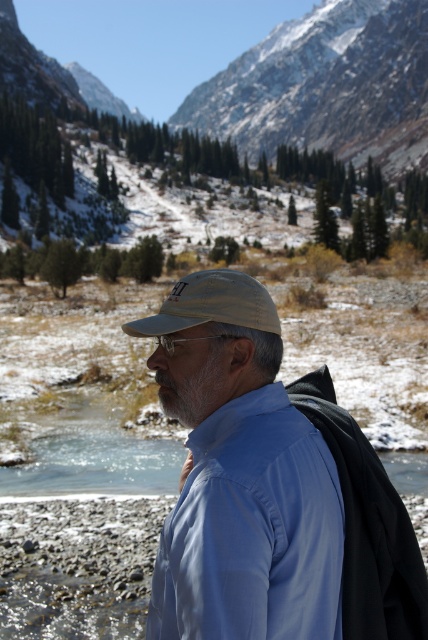
You are a photographer planning to capture a landscape shot with the blue smooth shirt at center and the snowy granite mountain at upper center. Which object should you focus on first if you want to ensure both are in sharp focus?

The blue smooth shirt at center has a lesser width compared to snowy granite mountain at upper center, so you should focus on the snowy granite mountain at upper center first because it is larger and will require more precise focus to capture its details.

You are a photographer wanting to capture the man in the image. Since the snowy rocky mountain at upper center and the tan fabric cap at center are both in your view, which object is closer to you?

The snowy rocky mountain at upper center is closer to you because the tan fabric cap at center is behind it.

You are a hiker trying to locate the snowy rocky mountain at upper center. According to the map coordinates provided, where exactly is it positioned?

The snowy rocky mountain at upper center is located at point (326, 86).